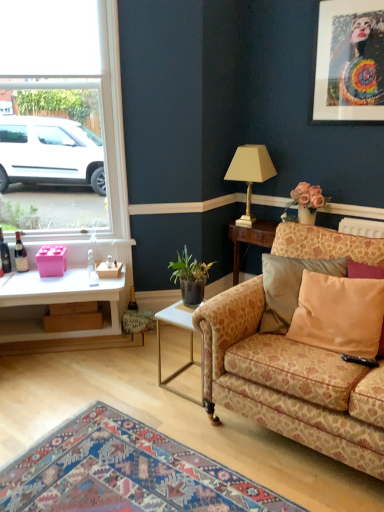
At what (x,y) coordinates should I click in order to perform the action: click on vacant position to the left of clear glass bottle at left, the 3th bottle when ordered from left to right. Please return your answer as a coordinate pair (x, y). This screenshot has height=512, width=384. Looking at the image, I should click on (68, 279).